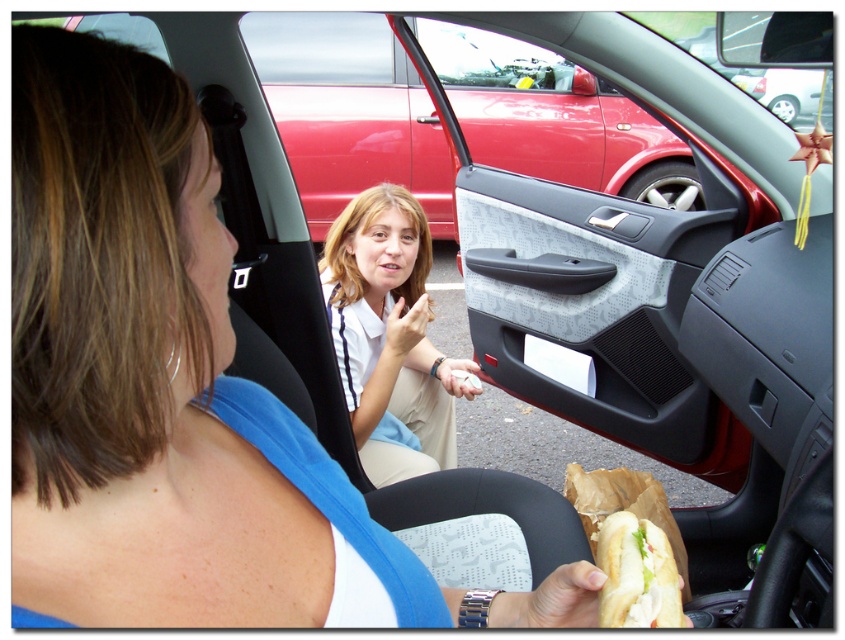
Is light brown fabric shirt at center to the right of white bread sandwich at lower right from the viewer's perspective?

No, light brown fabric shirt at center is not to the right of white bread sandwich at lower right.

Measure the distance between light brown fabric shirt at center and camera.

5.80 feet

Is point (435, 436) more distant than point (644, 570)?

Yes.

Find the location of a particular element. light brown fabric shirt at center is located at coordinates (390, 333).